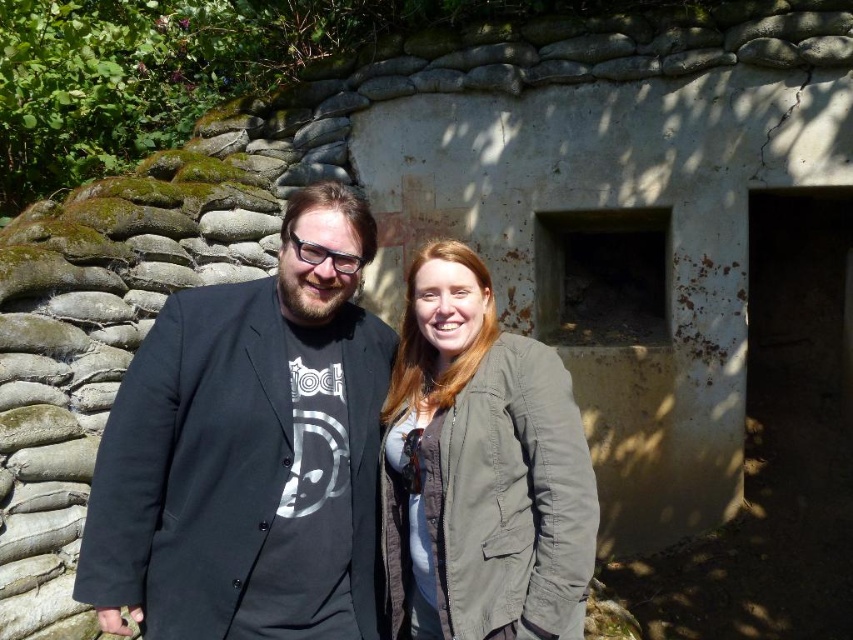
Does black matte jacket at center have a lesser width compared to green matte jacket at center?

In fact, black matte jacket at center might be wider than green matte jacket at center.

Describe the element at coordinates (248, 451) in the screenshot. The image size is (853, 640). I see `black matte jacket at center` at that location.

Where is `black matte jacket at center`? The height and width of the screenshot is (640, 853). black matte jacket at center is located at coordinates (248, 451).